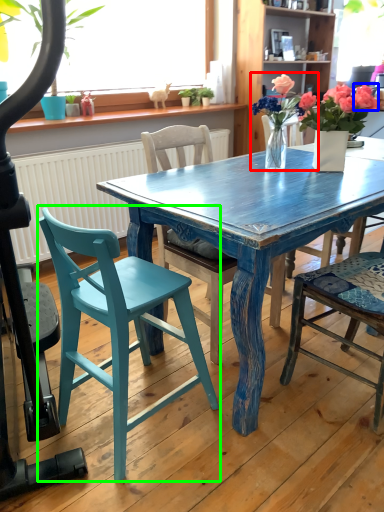
Question: Considering the real-world distances, which object is closest to houseplant (highlighted by a red box)? flower (highlighted by a blue box) or chair (highlighted by a green box).

Choices:
 (A) flower
 (B) chair

Answer: (A)